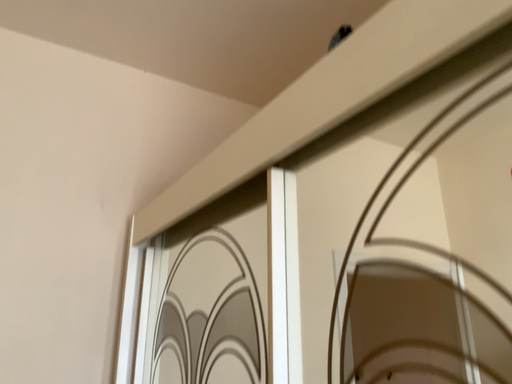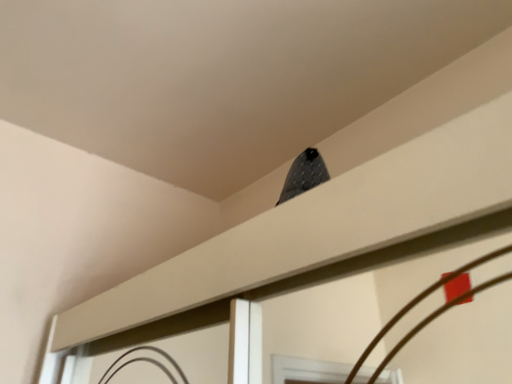
Question: How did the camera likely rotate when shooting the video?

Choices:
 (A) rotated right
 (B) rotated left

Answer: (A)